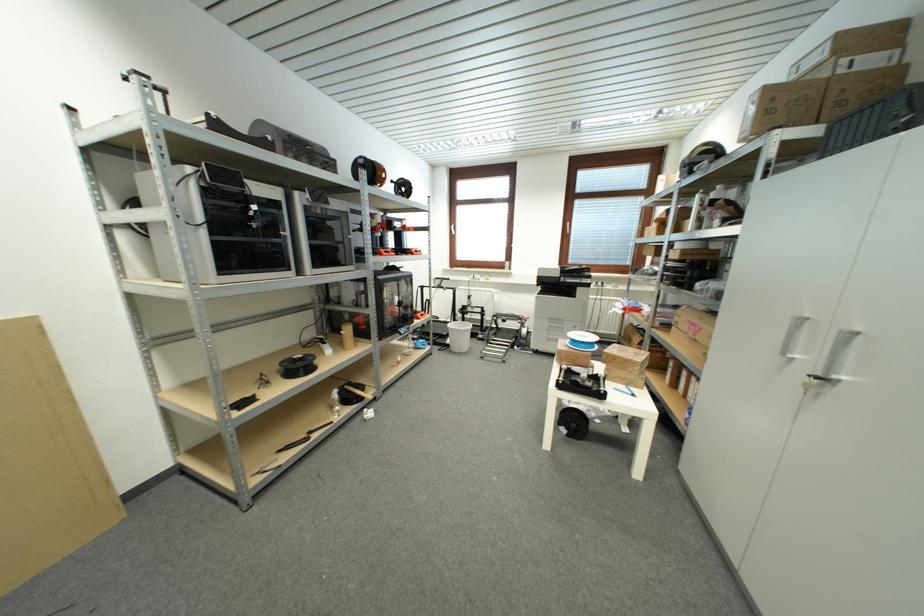
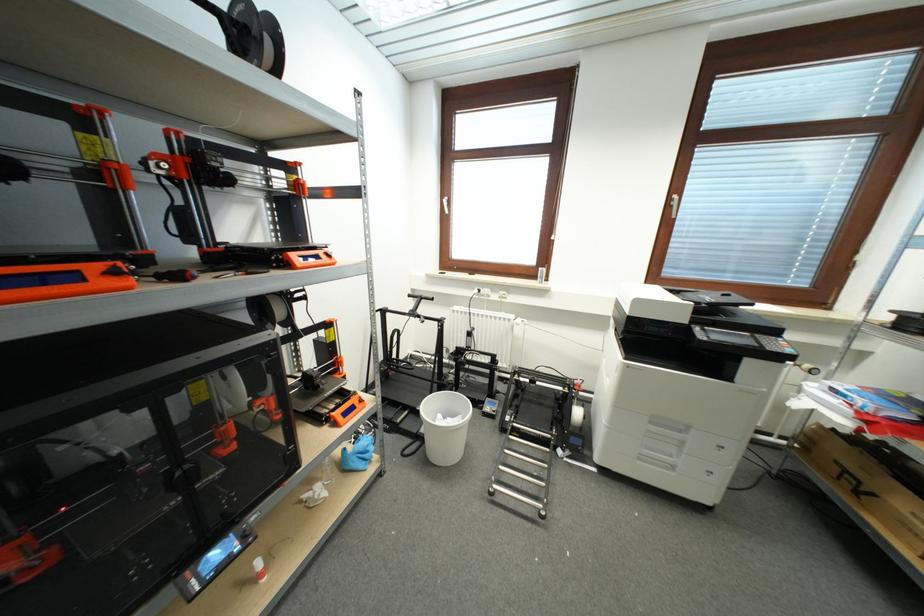
Where in the second image is the point corresponding to [408,190] from the first image?

(260, 39)